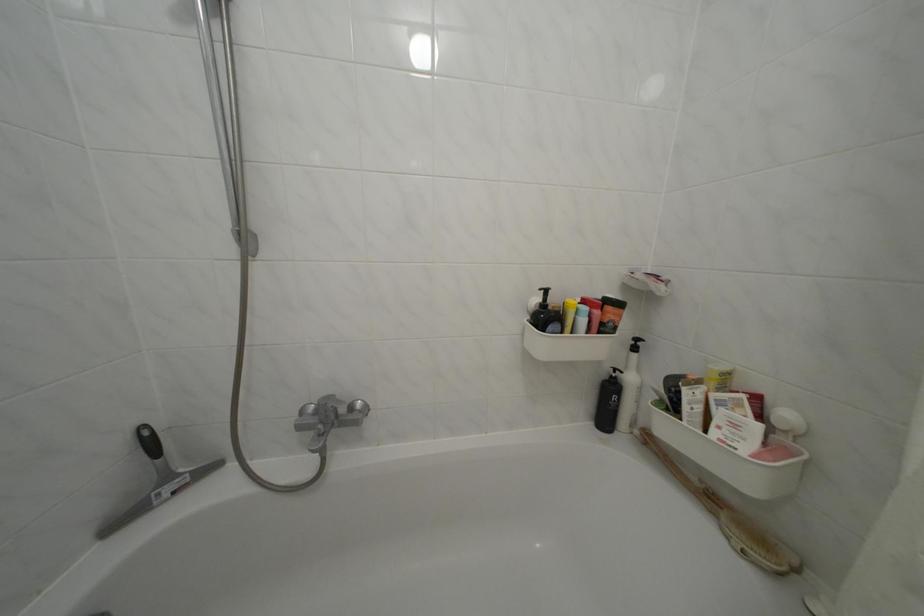
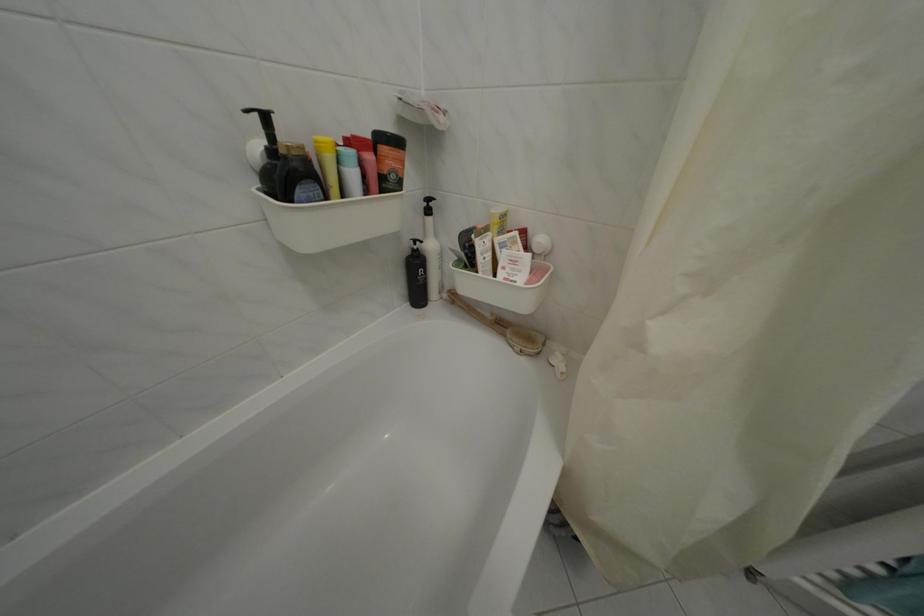
First-person continuous shooting, in which direction is the camera rotating?

The rotation direction of the camera is right-down.